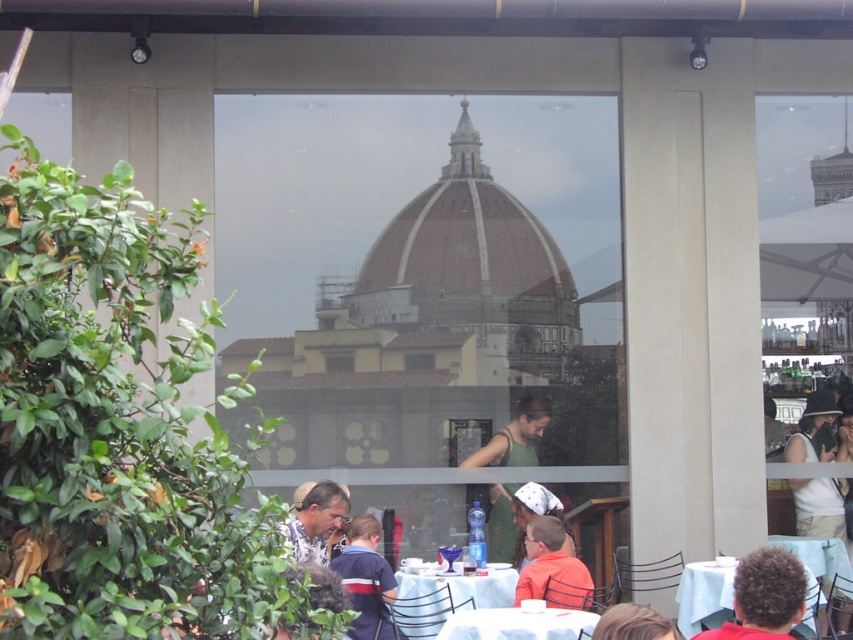
Question: From the image, what is the correct spatial relationship of white tablecloth at lower right in relation to matte white shirt at lower center?

Choices:
 (A) left
 (B) right

Answer: (B)

Question: Does white plastic table at center appear over matte white shirt at lower center?

Choices:
 (A) no
 (B) yes

Answer: (A)

Question: Which object is the closest to the brown hair at center?

Choices:
 (A) white tablecloth at lower right
 (B) matte white shirt at lower center

Answer: (A)

Question: Does green fabric dress at center appear under matte white shirt at lower center?

Choices:
 (A) no
 (B) yes

Answer: (A)

Question: Which object is closer to the camera taking this photo?

Choices:
 (A) green fabric dress at center
 (B) white plastic table at center
 (C) matte white tank top at center

Answer: (B)

Question: Which object is farther from the camera taking this photo?

Choices:
 (A) orange shirt at center
 (B) brown hair at center

Answer: (A)